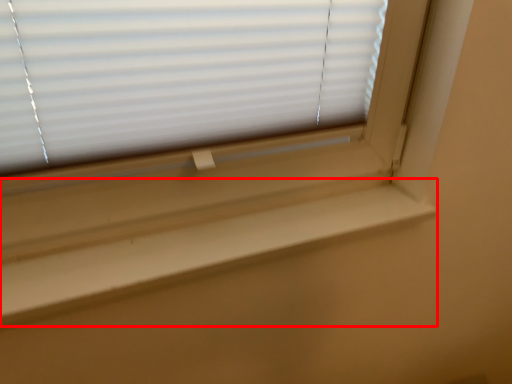
Question: Where is window sill (annotated by the red box) located in relation to window blind in the image?

Choices:
 (A) left
 (B) right

Answer: (B)